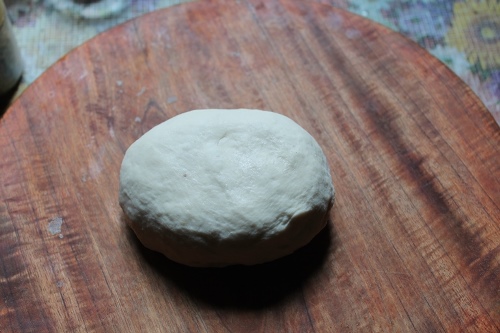
The width and height of the screenshot is (500, 333). What are the coordinates of `yellow flower on tablecloth` in the screenshot? It's located at (462, 27).